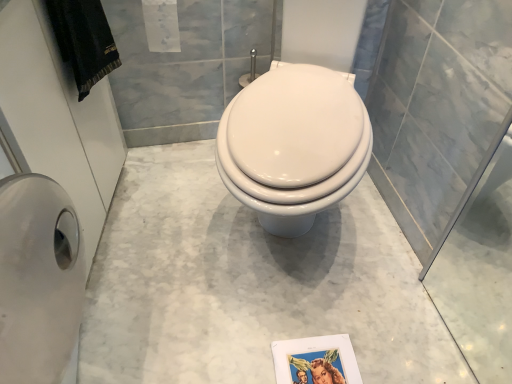
Locate an element on the screen. The height and width of the screenshot is (384, 512). white paper at upper center is located at coordinates (161, 25).

What do you see at coordinates (161, 25) in the screenshot?
I see `white paper at upper center` at bounding box center [161, 25].

Image resolution: width=512 pixels, height=384 pixels. I want to click on white paper at upper center, so click(161, 25).